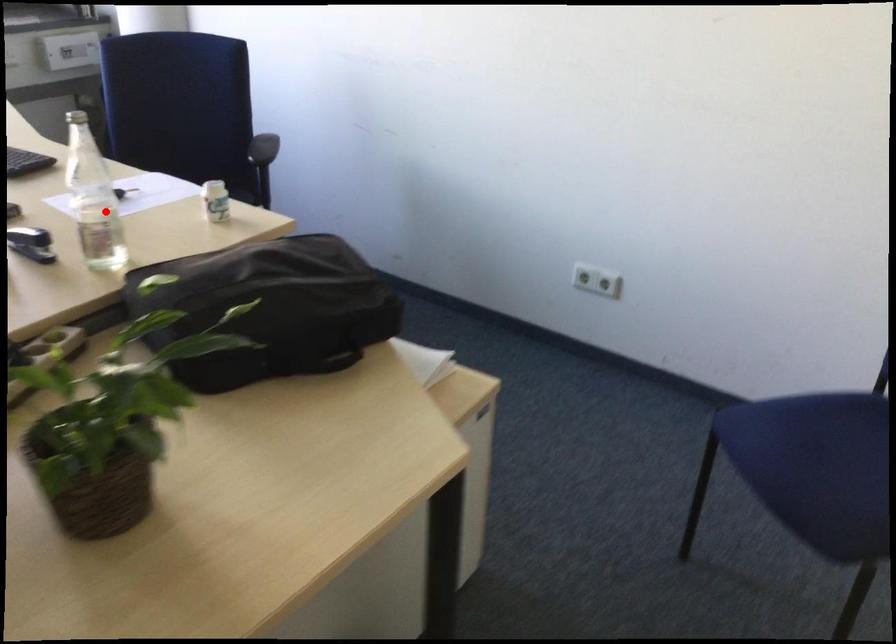
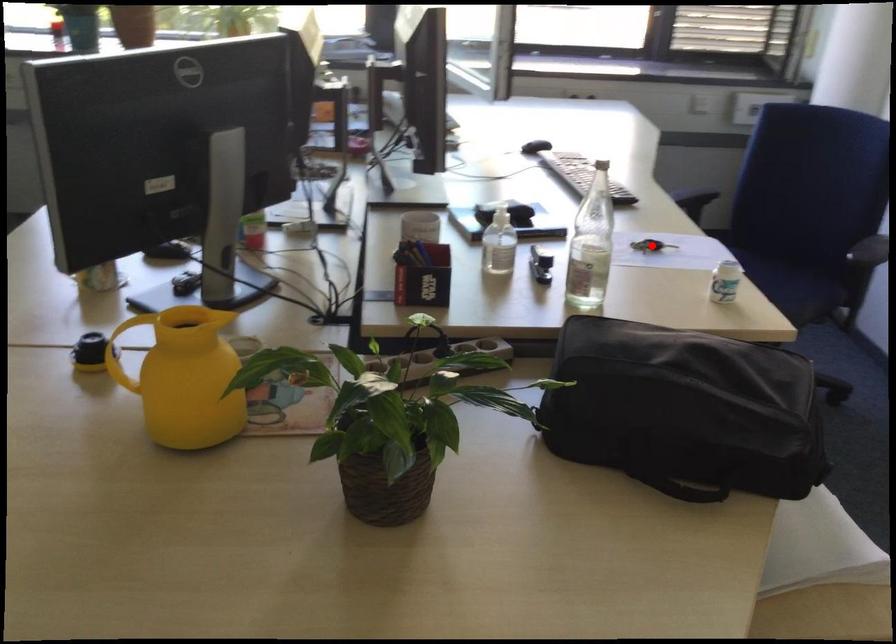
I am providing you with two images of the same scene from different viewpoints. A red point is marked on the first image and another point is marked on the second image. Does the point marked in image1 correspond to the same location as the one in image2?

No